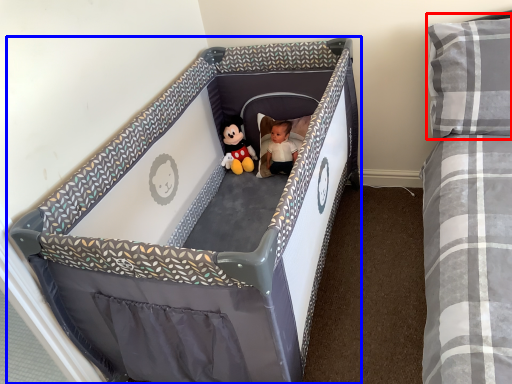
Question: Which object is further to the camera taking this photo, pillow (highlighted by a red box) or infant bed (highlighted by a blue box)?

Choices:
 (A) pillow
 (B) infant bed

Answer: (A)